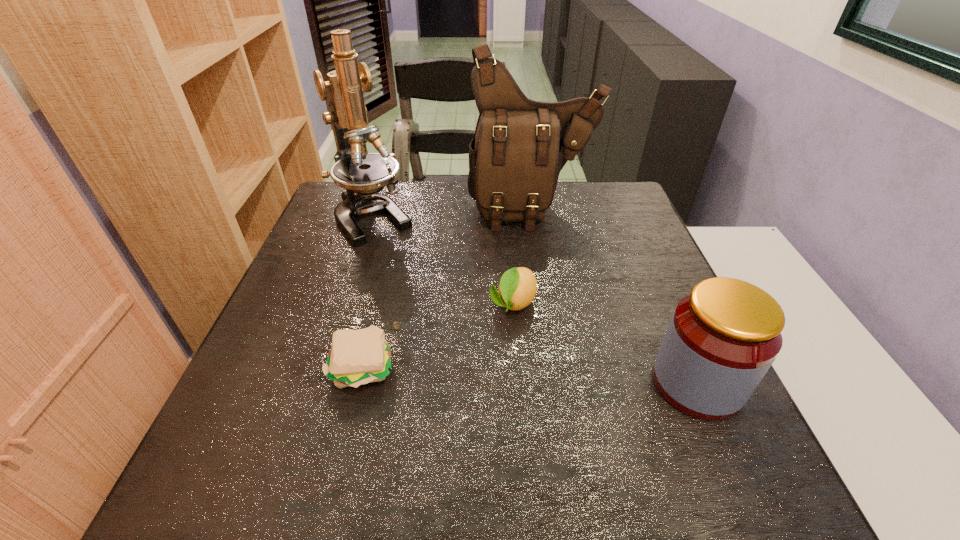
Where is `patty`? This screenshot has width=960, height=540. patty is located at coordinates (357, 357).

Find the location of `jar`. jar is located at coordinates (723, 337).

Image resolution: width=960 pixels, height=540 pixels. Find the location of `microscope`. microscope is located at coordinates (363, 175).

The height and width of the screenshot is (540, 960). I want to click on the fourth shortest object, so click(x=520, y=146).

I want to click on the third nearest object, so click(518, 286).

The height and width of the screenshot is (540, 960). What are the coordinates of `lemon` in the screenshot? It's located at (518, 286).

This screenshot has width=960, height=540. I want to click on vacant region located on the right of the shortest object, so click(541, 367).

In order to click on vacant area situated on the back of the third tallest object in this screenshot , I will do tap(660, 298).

Locate an element on the screen. The width and height of the screenshot is (960, 540). free space located at the eyepiece of the microscope is located at coordinates (432, 293).

Where is `vacant region located 0.270m at the eyepiece of the microscope`? This screenshot has width=960, height=540. vacant region located 0.270m at the eyepiece of the microscope is located at coordinates (441, 302).